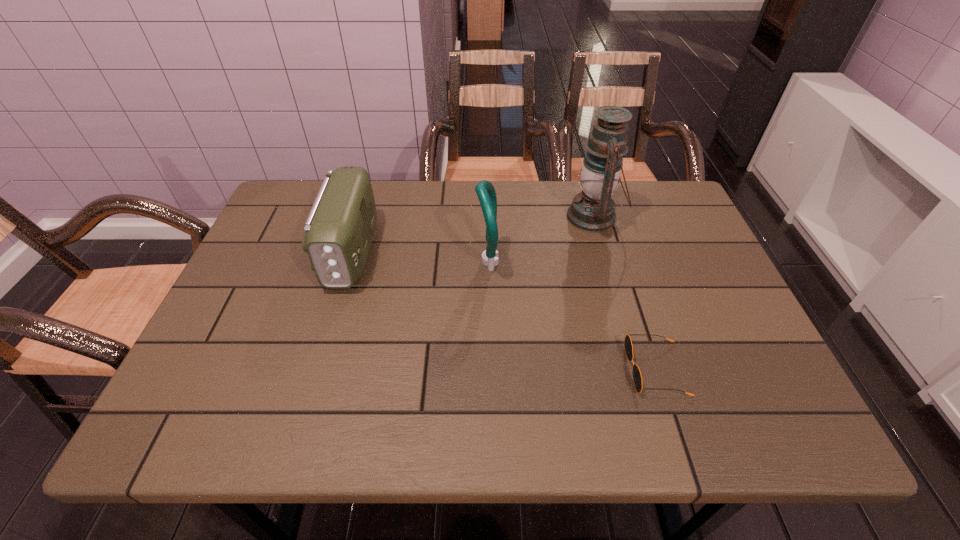
The image size is (960, 540). I want to click on empty space between the leftmost object and the third shortest object, so click(x=420, y=256).

The width and height of the screenshot is (960, 540). I want to click on free spot between the nearest object and the tallest object, so click(x=625, y=293).

Find the location of a particular element. The width and height of the screenshot is (960, 540). free spot between the shortest object and the leftmost object is located at coordinates (503, 310).

You are a GUI agent. You are given a task and a screenshot of the screen. Output one action in this format:
    pyautogui.click(x=<x>, y=<y>)
    Task: Click on the vacant region between the tallest object and the radio_receiver
    The height and width of the screenshot is (540, 960).
    Given the screenshot: What is the action you would take?
    click(x=472, y=234)

This screenshot has height=540, width=960. What are the coordinates of `object that is the closest to the bottle opener` in the screenshot? It's located at (593, 210).

Image resolution: width=960 pixels, height=540 pixels. What are the coordinates of `object that is the third closest to the bottle opener` in the screenshot? It's located at (637, 378).